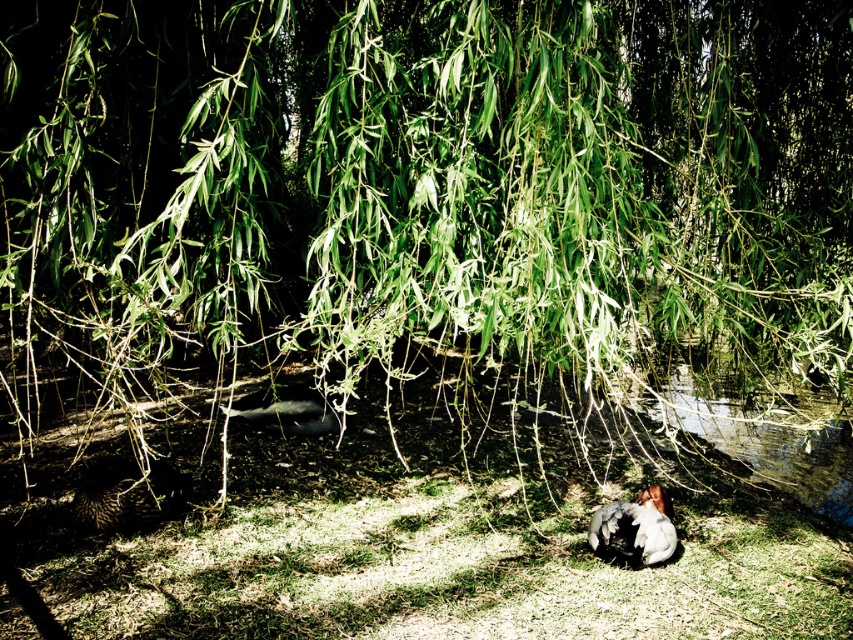
Looking at this image, you are a nature photographer trying to capture both the speckled feathered bird at lower center and the brown fuzzy bird at center in a single frame. Based on their sizes in the image, which bird would require you to zoom out more to ensure both fit in the photo?

The speckled feathered bird at lower center occupies less space than brown fuzzy bird at center, so you would need to zoom out more to accommodate the larger brown fuzzy bird at center in the frame.